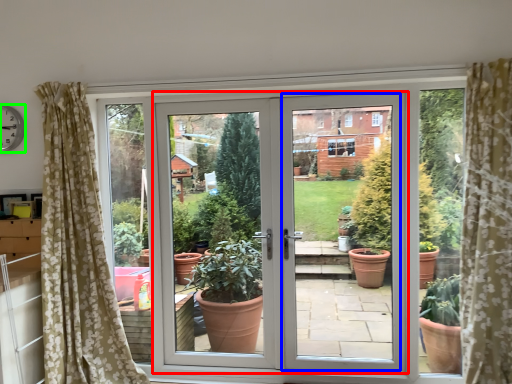
Question: Which object is positioned closest to door (highlighted by a red box)? Select from screen door (highlighted by a blue box) and clock (highlighted by a green box).

Choices:
 (A) screen door
 (B) clock

Answer: (A)